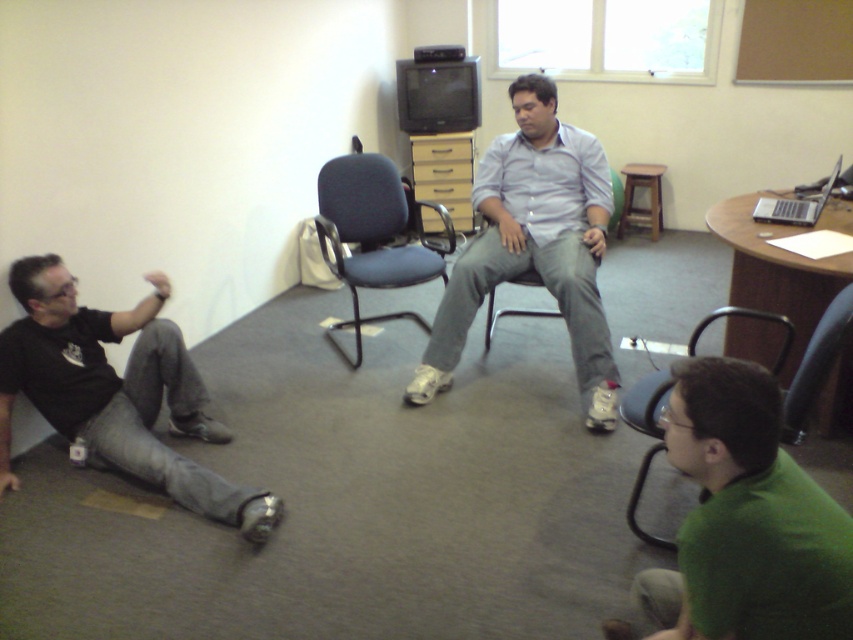
Who is positioned more to the right, blue fabric chair at center or black mesh chair at lower right?

black mesh chair at lower right is more to the right.

Where is `blue fabric chair at center`? Image resolution: width=853 pixels, height=640 pixels. blue fabric chair at center is located at coordinates (374, 232).

Who is more forward, (347,180) or (637,419)?

Point (637,419)

Where is `blue fabric chair at center`? The width and height of the screenshot is (853, 640). blue fabric chair at center is located at coordinates (374, 232).

Describe the element at coordinates (746, 518) in the screenshot. I see `green matte shirt at lower right` at that location.

Which is below, green matte shirt at lower right or blue fabric chair at center?

green matte shirt at lower right is below.

Who is more distant from viewer, [763,442] or [427,332]?

The point [427,332] is more distant.

Identify the location of green matte shirt at lower right. (746, 518).

How distant is light blue shirt at center from matte blue chair at center?

The distance of light blue shirt at center from matte blue chair at center is 14.70 inches.

Can you confirm if light blue shirt at center is shorter than matte blue chair at center?

No.

Does point (577, 358) come in front of point (614, 184)?

Yes, point (577, 358) is in front of point (614, 184).

Identify the location of light blue shirt at center. The image size is (853, 640). click(534, 244).